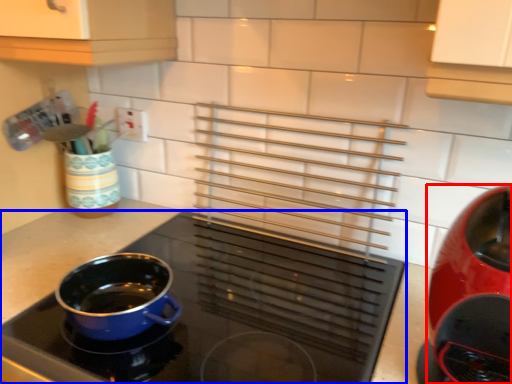
Question: Which object appears closest to the camera in this image, kitchen appliance (highlighted by a red box) or kitchen appliance (highlighted by a blue box)?

Choices:
 (A) kitchen appliance
 (B) kitchen appliance

Answer: (B)